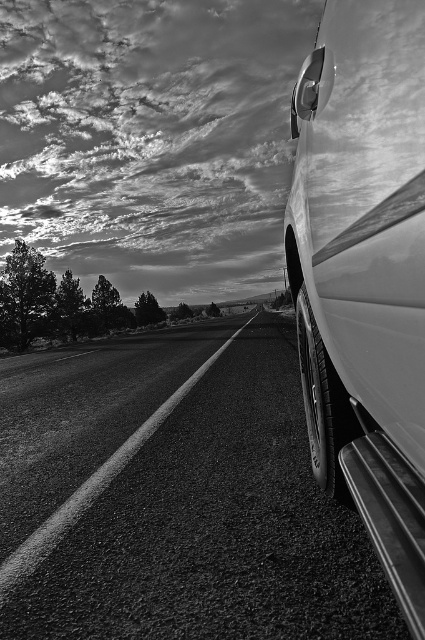
You are a delivery driver who needs to exit the glossy white car at right and reach the glossy white car door at lower right. Considering the space between them, can you step out without needing to move the car first?

The distance between the glossy white car at right and the glossy white car door at lower right is 7.51 inches. Since this distance is too narrow to step out comfortably, you should move the car first before exiting.

You are a passenger in a car and want to exit through the glossy white car door at lower right. Based on the scene, which side of the glossy white car at right should you exit from?

The glossy white car at right is positioned on the right side of the glossy white car door at lower right, so you should exit from the right side of the glossy white car at right to reach the glossy white car door at lower right.